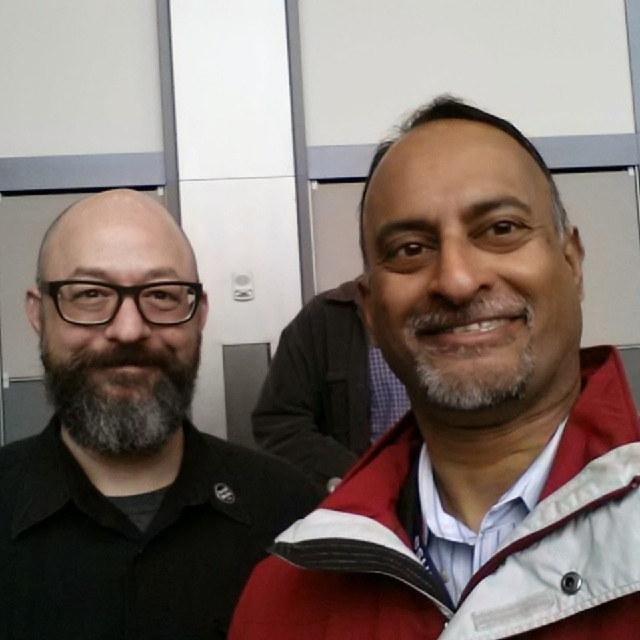
Is gray matte beard at center smaller than gray matte beard at left?

Yes, gray matte beard at center is smaller than gray matte beard at left.

Is gray matte beard at center above gray matte beard at left?

Yes.

What do you see at coordinates (467, 349) in the screenshot? This screenshot has height=640, width=640. I see `gray matte beard at center` at bounding box center [467, 349].

Find the location of a particular element. gray matte beard at center is located at coordinates (467, 349).

The height and width of the screenshot is (640, 640). Describe the element at coordinates (128, 445) in the screenshot. I see `matte black shirt at left` at that location.

Between point (38, 289) and point (176, 401), which one is positioned in front?

Point (38, 289) is more forward.

Where is `matte black shirt at left`? matte black shirt at left is located at coordinates (128, 445).

Does red fleece jacket at center come behind gray matte beard at center?

No, red fleece jacket at center is in front of gray matte beard at center.

Does point (531, 624) lie behind point (499, 369)?

No, (531, 624) is in front of (499, 369).

Identify the location of red fleece jacket at center. This screenshot has width=640, height=640. (486, 561).